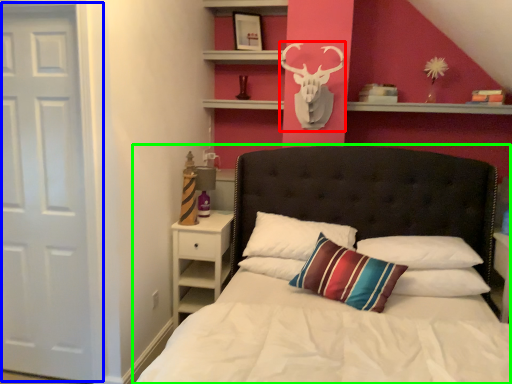
Question: Estimate the real-world distances between objects in this image. Which object is farther from deer (highlighted by a red box), door (highlighted by a blue box) or bed (highlighted by a green box)?

Choices:
 (A) door
 (B) bed

Answer: (A)